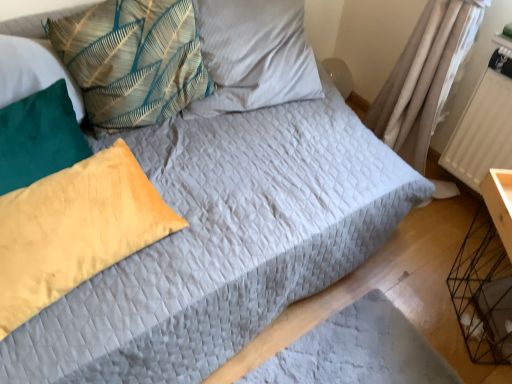
Question: Can you confirm if textured fabric pillow at upper center, which ranks as the 4th pillow in bottom-to-top order, is wider than teal fabric pillow at upper left, the third pillow when ordered from bottom to top?

Choices:
 (A) no
 (B) yes

Answer: (B)

Question: Can you confirm if textured fabric pillow at upper center, the first pillow from the top, is positioned to the left of teal fabric pillow at upper left, which is counted as the 2th pillow, starting from the top?

Choices:
 (A) no
 (B) yes

Answer: (A)

Question: Would you say textured fabric pillow at upper center, which ranks as the 4th pillow in bottom-to-top order, is a long distance from teal fabric pillow at upper left, the third pillow when ordered from bottom to top?

Choices:
 (A) no
 (B) yes

Answer: (A)

Question: From the image's perspective, is textured fabric pillow at upper center, the first pillow from the top, under teal fabric pillow at upper left, the third pillow when ordered from bottom to top?

Choices:
 (A) yes
 (B) no

Answer: (B)

Question: Is textured fabric pillow at upper center, which ranks as the 4th pillow in bottom-to-top order, touching teal fabric pillow at upper left, the third pillow when ordered from bottom to top?

Choices:
 (A) yes
 (B) no

Answer: (B)

Question: Relative to yellow cotton pillow at left, the third pillow positioned from the top, is black wire crate at lower right in front or behind?

Choices:
 (A) front
 (B) behind

Answer: (B)

Question: Is black wire crate at lower right taller or shorter than yellow cotton pillow at left, positioned as the 2th pillow in bottom-to-top order?

Choices:
 (A) short
 (B) tall

Answer: (B)

Question: Which is correct: black wire crate at lower right is inside yellow cotton pillow at left, the third pillow positioned from the top, or outside of it?

Choices:
 (A) inside
 (B) outside

Answer: (B)

Question: Does point (498, 309) appear closer or farther from the camera than point (46, 155)?

Choices:
 (A) farther
 (B) closer

Answer: (A)

Question: From a real-world perspective, is yellow cotton pillow at left, positioned as the 2th pillow in bottom-to-top order, positioned above or below teal fabric pillow at upper left, which is counted as the 2th pillow, starting from the top?

Choices:
 (A) below
 (B) above

Answer: (A)

Question: Is yellow cotton pillow at left, positioned as the 2th pillow in bottom-to-top order, situated inside teal fabric pillow at upper left, the third pillow when ordered from bottom to top, or outside?

Choices:
 (A) inside
 (B) outside

Answer: (B)

Question: Considering the relative positions of yellow cotton pillow at left, positioned as the 2th pillow in bottom-to-top order, and teal fabric pillow at upper left, the third pillow when ordered from bottom to top, in the image provided, is yellow cotton pillow at left, positioned as the 2th pillow in bottom-to-top order, to the left or to the right of teal fabric pillow at upper left, the third pillow when ordered from bottom to top,?

Choices:
 (A) left
 (B) right

Answer: (A)

Question: In terms of height, does yellow cotton pillow at left, positioned as the 2th pillow in bottom-to-top order, look taller or shorter compared to teal fabric pillow at upper left, the third pillow when ordered from bottom to top?

Choices:
 (A) tall
 (B) short

Answer: (B)

Question: Considering the positions of point (475, 137) and point (294, 36), is point (475, 137) closer or farther from the camera than point (294, 36)?

Choices:
 (A) closer
 (B) farther

Answer: (B)

Question: Is white textured radiator at right taller or shorter than textured fabric pillow at upper center, the first pillow from the top?

Choices:
 (A) short
 (B) tall

Answer: (B)